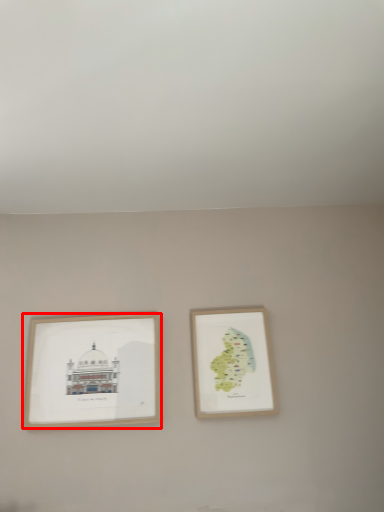
Question: Considering the relative positions of picture frame (annotated by the red box) and picture frame in the image provided, where is picture frame (annotated by the red box) located with respect to the staircase?

Choices:
 (A) right
 (B) left

Answer: (B)